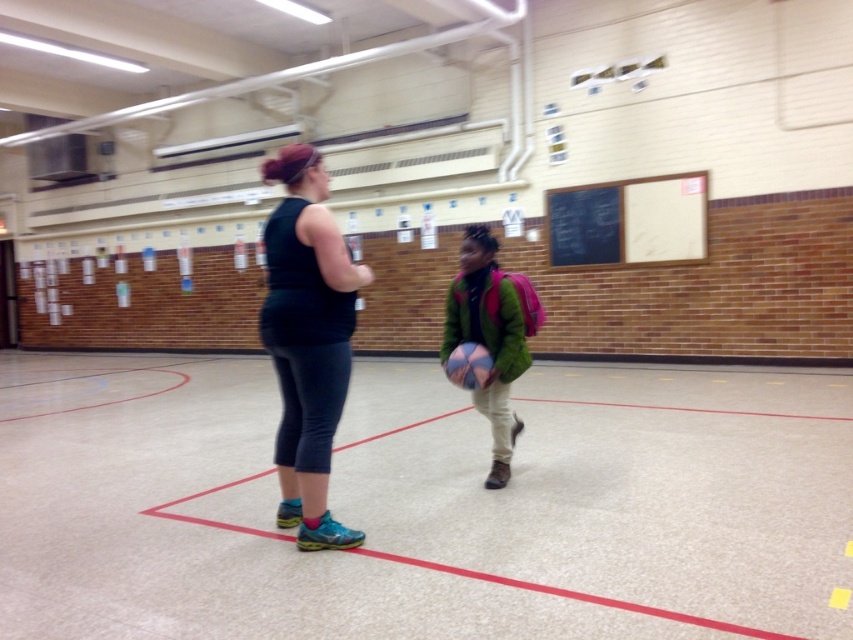
Looking at this image, is black matte leggings at center taller than green fuzzy jacket at center?

Yes.

Is point (281, 200) closer to viewer compared to point (469, 241)?

No.

Where is `black matte leggings at center`? black matte leggings at center is located at coordinates (306, 340).

Find the location of `black matte leggings at center`. black matte leggings at center is located at coordinates (306, 340).

Is black matte leggings at center further to camera compared to multicolored fabric basketball at center?

No, it is not.

Does black matte leggings at center have a greater width compared to multicolored fabric basketball at center?

Correct, the width of black matte leggings at center exceeds that of multicolored fabric basketball at center.

Locate an element on the screen. black matte leggings at center is located at coordinates (306, 340).

This screenshot has width=853, height=640. Identify the location of black matte leggings at center. (306, 340).

Between black chalkboard at upper right and multicolored fabric basketball at center, which one has more height?

black chalkboard at upper right

Can you confirm if black chalkboard at upper right is taller than multicolored fabric basketball at center?

Indeed, black chalkboard at upper right has a greater height compared to multicolored fabric basketball at center.

Is point (676, 209) positioned behind point (479, 385)?

Yes.

Find the location of `black chalkboard at upper right`. black chalkboard at upper right is located at coordinates (628, 221).